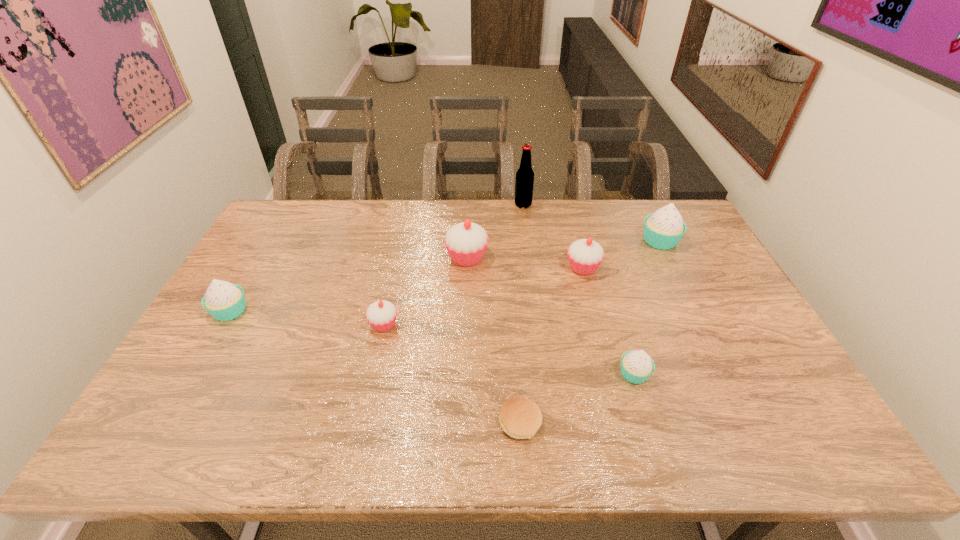
Locate an element on the screen. Image resolution: width=960 pixels, height=540 pixels. vacant region between the sixth object from right to left and the biggest white cupcake is located at coordinates (564, 249).

Where is `unoccupied area between the fifth cupcake from right to left and the rightmost cupcake`? This screenshot has width=960, height=540. unoccupied area between the fifth cupcake from right to left and the rightmost cupcake is located at coordinates pyautogui.click(x=522, y=283).

Identify the location of vacant space in between the biggest pink cupcake and the shortest object. (493, 340).

The image size is (960, 540). In order to click on free spot between the biggest pink cupcake and the nearest cupcake in this screenshot , I will do `click(550, 316)`.

Locate an element on the screen. This screenshot has width=960, height=540. unoccupied area between the rightmost pink cupcake and the beer bottle is located at coordinates (553, 237).

Choose which object is the sixth nearest neighbor to the seventh object from right to left. Please provide its 2D coordinates. Your answer should be formatted as a tuple, i.e. [(x, y)], where the tuple contains the x and y coordinates of a point satisfying the conditions above.

[(524, 182)]

Identify which object is located as the sixth nearest to the rightmost pink cupcake. Please provide its 2D coordinates. Your answer should be formatted as a tuple, i.e. [(x, y)], where the tuple contains the x and y coordinates of a point satisfying the conditions above.

[(381, 315)]

The width and height of the screenshot is (960, 540). I want to click on the closest cupcake to the patty, so (x=637, y=366).

Image resolution: width=960 pixels, height=540 pixels. What are the coordinates of `cupcake identified as the third closest to the rightmost pink cupcake` in the screenshot? It's located at (637, 366).

Locate which pink cupcake is the second closest to the second smallest pink cupcake. Please provide its 2D coordinates. Your answer should be formatted as a tuple, i.e. [(x, y)], where the tuple contains the x and y coordinates of a point satisfying the conditions above.

[(381, 315)]